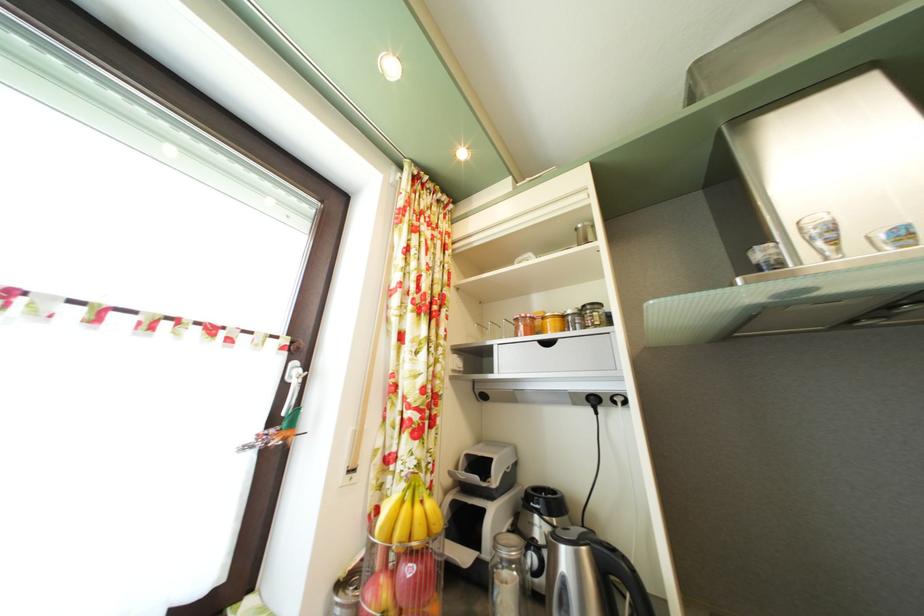
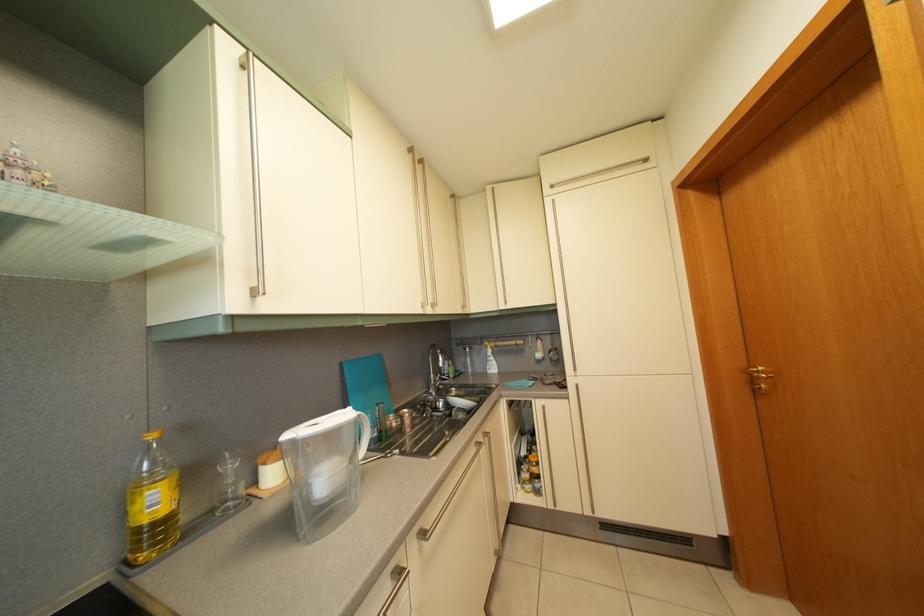
Question: The first image is from the beginning of the video and the second image is from the end. How did the camera likely rotate when shooting the video?

Choices:
 (A) Left
 (B) Right
 (C) Up
 (D) Down

Answer: (B)